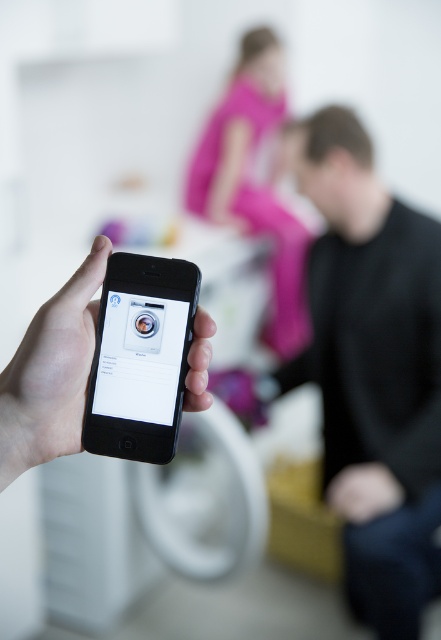
Which of these two, black matte shirt at right or white glossy washing machine at center, stands shorter?

white glossy washing machine at center

Measure the distance between point (392, 394) and camera.

Point (392, 394) and camera are 6.30 feet apart.

I want to click on black matte shirt at right, so click(x=373, y=371).

This screenshot has height=640, width=441. Find the location of `black matte shirt at right`. black matte shirt at right is located at coordinates (373, 371).

Does pink fabric pants at upper center appear on the right side of white glossy washing machine at center?

Correct, you'll find pink fabric pants at upper center to the right of white glossy washing machine at center.

Is pink fabric pants at upper center smaller than white glossy washing machine at center?

No, pink fabric pants at upper center is not smaller than white glossy washing machine at center.

Between point (212, 125) and point (122, 365), which one is positioned in front?

Point (122, 365)

What are the coordinates of `pink fabric pants at upper center` in the screenshot? It's located at (254, 180).

Does black matte shirt at right appear over pink fabric pants at upper center?

No, black matte shirt at right is not above pink fabric pants at upper center.

The height and width of the screenshot is (640, 441). I want to click on black matte shirt at right, so click(373, 371).

At what (x,y) coordinates should I click in order to perform the action: click on black matte shirt at right. Please return your answer as a coordinate pair (x, y). Looking at the image, I should click on tap(373, 371).